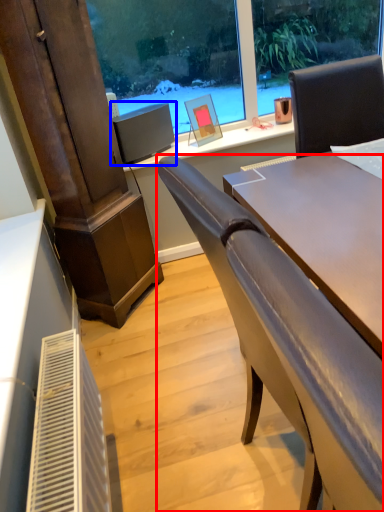
Question: Which of the following is the closest to the observer, chair (highlighted by a red box) or computer monitor (highlighted by a blue box)?

Choices:
 (A) chair
 (B) computer monitor

Answer: (A)